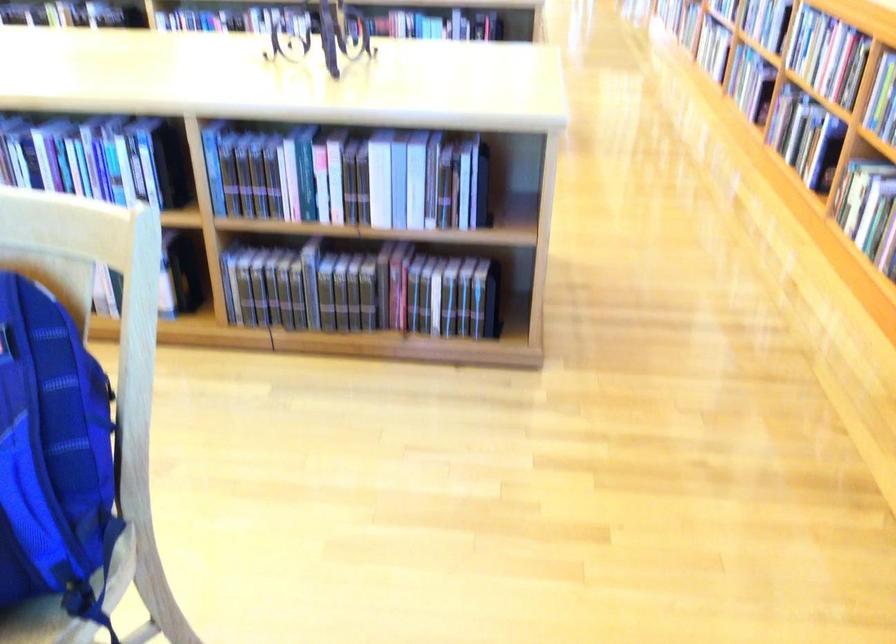
Where is `blue backpack`? blue backpack is located at coordinates (53, 458).